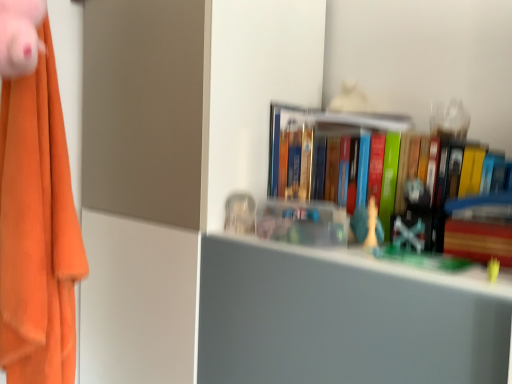
What is the approximate height of orange fabric at left?

The height of orange fabric at left is 31.15 inches.

This screenshot has height=384, width=512. Describe the element at coordinates (20, 36) in the screenshot. I see `pink plush toy at upper left, the third toy when ordered from right to left` at that location.

The image size is (512, 384). Describe the element at coordinates (240, 214) in the screenshot. I see `clear plastic container at center, the second toy when ordered from right to left` at that location.

Describe the element at coordinates (480, 228) in the screenshot. I see `wooden paperback book at right` at that location.

The image size is (512, 384). Describe the element at coordinates (385, 178) in the screenshot. I see `hardcover books at upper right` at that location.

The image size is (512, 384). I want to click on white plastic chess piece at center, the 2th toy viewed from the back, so click(x=371, y=224).

From the image's perspective, is orange fabric at left located above or below wooden paperback book at right?

orange fabric at left is above wooden paperback book at right.

Where is `clothe on the left of wooden paperback book at right`? The width and height of the screenshot is (512, 384). clothe on the left of wooden paperback book at right is located at coordinates (70, 80).

Which is behind, point (79, 46) or point (504, 218)?

Positioned behind is point (79, 46).

In the scene shown: Is orange fabric at left positioned with its back to wooden paperback book at right?

No, orange fabric at left is not facing the opposite direction of wooden paperback book at right.

Is wooden paperback book at right positioned with its back to pink plush toy at upper left, acting as the 1th toy starting from the top?

No.

From the image's perspective, between wooden paperback book at right and pink plush toy at upper left, which is the first toy from front to back, which one is located above?

pink plush toy at upper left, which is the first toy from front to back, is shown above in the image.

Is wooden paperback book at right shorter than pink plush toy at upper left, placed as the 3th toy when sorted from bottom to top?

Yes, wooden paperback book at right is shorter than pink plush toy at upper left, placed as the 3th toy when sorted from bottom to top.

Does point (508, 261) come closer to viewer compared to point (4, 13)?

That is False.

Find the location of a particular element. The height and width of the screenshot is (384, 512). book located in front of the white plastic chess piece at center, placed as the first toy when sorted from bottom to top is located at coordinates (385, 178).

From the image's perspective, is white plastic chess piece at center, placed as the first toy when sorted from bottom to top, positioned above or below hardcover books at upper right?

From the image's perspective, white plastic chess piece at center, placed as the first toy when sorted from bottom to top, appears below hardcover books at upper right.

Can you confirm if white plastic chess piece at center, arranged as the third toy when viewed from the top, is shorter than hardcover books at upper right?

Yes.

Is wooden bookshelf at upper right to the left or to the right of hardcover books at upper right in the image?

From the image, it's evident that wooden bookshelf at upper right is to the left of hardcover books at upper right.

Is wooden bookshelf at upper right facing towards hardcover books at upper right?

Yes, wooden bookshelf at upper right is turned towards hardcover books at upper right.

From the picture: Can you confirm if wooden bookshelf at upper right is shorter than hardcover books at upper right?

Incorrect, the height of wooden bookshelf at upper right does not fall short of that of hardcover books at upper right.

Considering the positions of objects wooden bookshelf at upper right and hardcover books at upper right in the image provided, who is behind, wooden bookshelf at upper right or hardcover books at upper right?

hardcover books at upper right is further away from the camera.

Considering the sizes of orange fabric at left and clear plastic container at center, placed as the second toy when sorted from bottom to top, in the image, is orange fabric at left taller or shorter than clear plastic container at center, placed as the second toy when sorted from bottom to top,?

orange fabric at left is taller than clear plastic container at center, placed as the second toy when sorted from bottom to top.

In the scene shown: From a real-world perspective, is orange fabric at left positioned above or below clear plastic container at center, the 2th toy from the top?

orange fabric at left is above clear plastic container at center, the 2th toy from the top.

Considering the sizes of objects orange fabric at left and clear plastic container at center, placed as the second toy when sorted from bottom to top, in the image provided, who is bigger, orange fabric at left or clear plastic container at center, placed as the second toy when sorted from bottom to top,?

orange fabric at left is bigger.

Considering the relative sizes of orange fabric at left and clear plastic container at center, the 2th toy from the top, in the image provided, is orange fabric at left wider than clear plastic container at center, the 2th toy from the top,?

Yes, orange fabric at left is wider than clear plastic container at center, the 2th toy from the top.

In the image, is wooden paperback book at right on the left side or the right side of clear plastic container at center, the 2th toy from the top?

wooden paperback book at right is positioned on clear plastic container at center, the 2th toy from the top,'s right side.

In terms of size, does wooden paperback book at right appear bigger or smaller than clear plastic container at center, the second toy when ordered from right to left?

wooden paperback book at right is bigger than clear plastic container at center, the second toy when ordered from right to left.

Which object is closer to the camera, wooden paperback book at right or clear plastic container at center, arranged as the 2th toy when viewed from the left?

wooden paperback book at right is in front.

Is wooden paperback book at right not near clear plastic container at center, the second toy when ordered from right to left?

No, wooden paperback book at right is in close proximity to clear plastic container at center, the second toy when ordered from right to left.

Is white plastic chess piece at center, the 2th toy positioned from the front, completely or partially outside of clear plastic container at center, acting as the 1th toy starting from the back?

Indeed, white plastic chess piece at center, the 2th toy positioned from the front, is completely outside clear plastic container at center, acting as the 1th toy starting from the back.

From a real-world perspective, is white plastic chess piece at center, which is the third toy in left-to-right order, under clear plastic container at center, the 2th toy from the top?

Correct, in the physical world, white plastic chess piece at center, which is the third toy in left-to-right order, is lower than clear plastic container at center, the 2th toy from the top.

Which object is more forward, white plastic chess piece at center, placed as the first toy when sorted from bottom to top, or clear plastic container at center, the second toy when ordered from right to left?

white plastic chess piece at center, placed as the first toy when sorted from bottom to top, is more forward.

In the image, there is a wooden paperback book at right. In order to click on clothe above it (from the image's perspective) in this screenshot , I will do `click(70, 80)`.

What are the coordinates of `paperback book that appears behind the pink plush toy at upper left, the third toy when ordered from right to left` in the screenshot? It's located at (480, 228).

Looking at the image, which one is located closer to wooden paperback book at right, clear plastic container at center, arranged as the 2th toy when viewed from the left, or white plastic chess piece at center, arranged as the third toy when viewed from the top?

white plastic chess piece at center, arranged as the third toy when viewed from the top.

Estimate the real-world distances between objects in this image. Which object is further from hardcover books at upper right, pink plush toy at upper left, the third toy when ordered from right to left, or clear plastic container at center, the second toy when ordered from right to left?

Based on the image, pink plush toy at upper left, the third toy when ordered from right to left, appears to be further to hardcover books at upper right.

Estimate the real-world distances between objects in this image. Which object is further from orange fabric at left, hardcover books at upper right or white plastic chess piece at center, arranged as the third toy when viewed from the top?

white plastic chess piece at center, arranged as the third toy when viewed from the top, lies further to orange fabric at left than the other object.

Which object lies nearer to the anchor point pink plush toy at upper left, acting as the 1th toy starting from the top, clear plastic container at center, acting as the 1th toy starting from the back, or hardcover books at upper right?

clear plastic container at center, acting as the 1th toy starting from the back.

Estimate the real-world distances between objects in this image. Which object is further from white plastic chess piece at center, the 2th toy viewed from the back, orange fabric at left or wooden paperback book at right?

orange fabric at left.

From the picture: Considering their positions, is hardcover books at upper right positioned further to wooden bookshelf at upper right than white plastic chess piece at center, placed as the first toy when sorted from bottom to top?

white plastic chess piece at center, placed as the first toy when sorted from bottom to top, lies further to wooden bookshelf at upper right than the other object.

Estimate the real-world distances between objects in this image. Which object is closer to pink plush toy at upper left, the third toy when ordered from right to left, wooden bookshelf at upper right or clear plastic container at center, the 2th toy from the top?

The object closer to pink plush toy at upper left, the third toy when ordered from right to left, is clear plastic container at center, the 2th toy from the top.

Based on their spatial positions, is white plastic chess piece at center, arranged as the third toy when viewed from the top, or orange fabric at left closer to wooden paperback book at right?

white plastic chess piece at center, arranged as the third toy when viewed from the top, is closer to wooden paperback book at right.

The width and height of the screenshot is (512, 384). In order to click on book between clear plastic container at center, arranged as the 2th toy when viewed from the left, and wooden paperback book at right in this screenshot , I will do `click(385, 178)`.

Identify the location of bookcase situated between pink plush toy at upper left, placed as the 3th toy when sorted from bottom to top, and white plastic chess piece at center, which is the first toy from right to left, from left to right. (349, 71).

I want to click on bookcase between pink plush toy at upper left, placed as the 3th toy when sorted from bottom to top, and wooden paperback book at right from left to right, so click(x=349, y=71).

Locate an element on the screen. toy located between orange fabric at left and clear plastic container at center, marked as the 3th toy in a front-to-back arrangement, in the left-right direction is located at coordinates (20, 36).